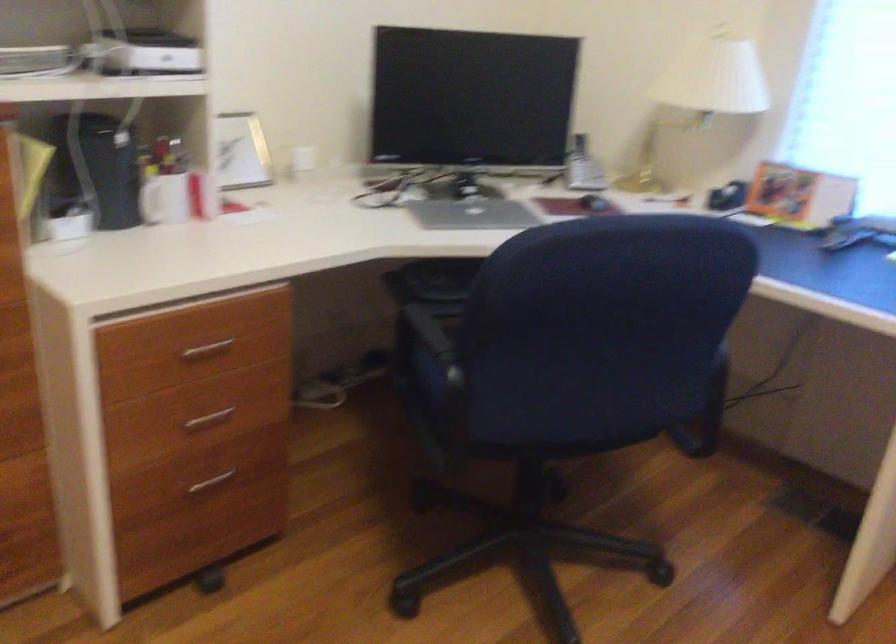
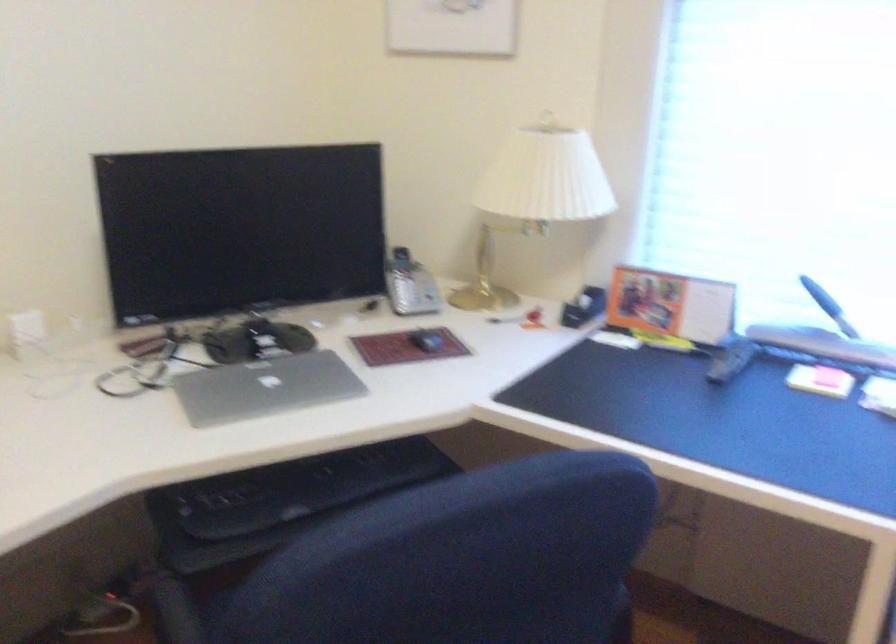
Find the pixel in the second image that matches [469,212] in the first image.

(264, 386)